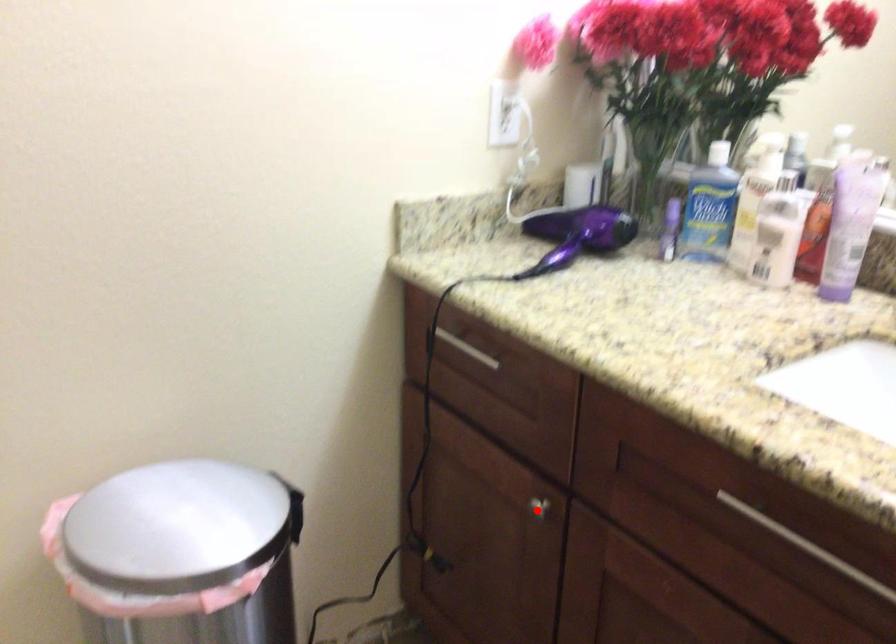
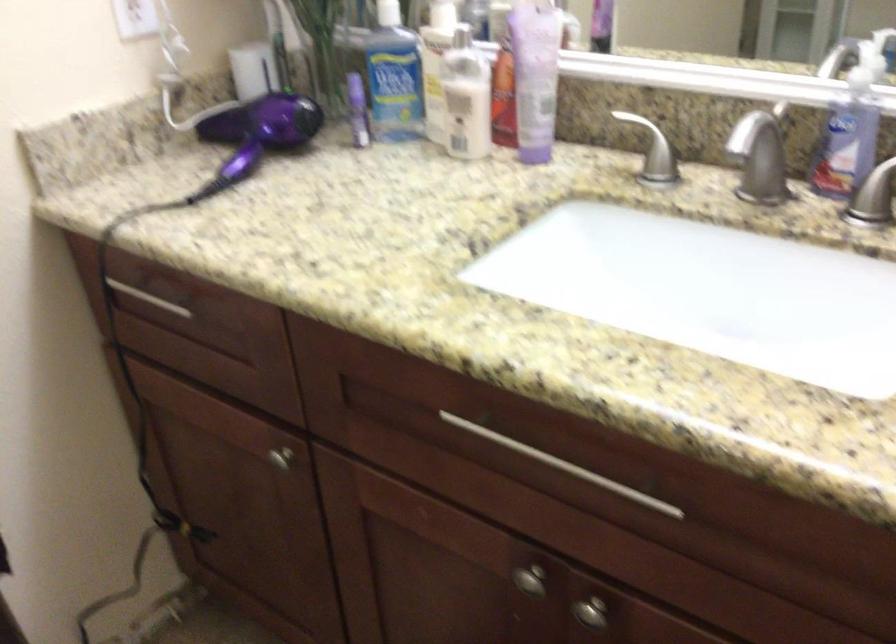
Find the pixel in the second image that matches the highlighted location in the first image.

(280, 459)